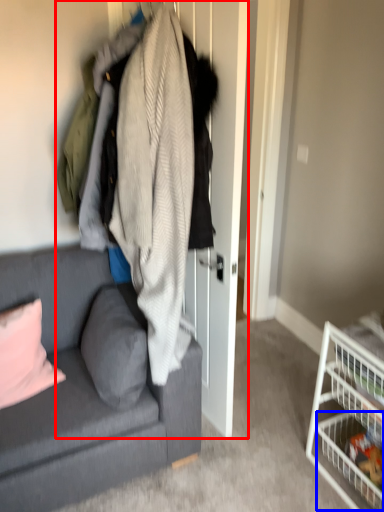
Question: Which point is further to the camera, closet (highlighted by a red box) or shelf (highlighted by a blue box)?

Choices:
 (A) closet
 (B) shelf

Answer: (B)